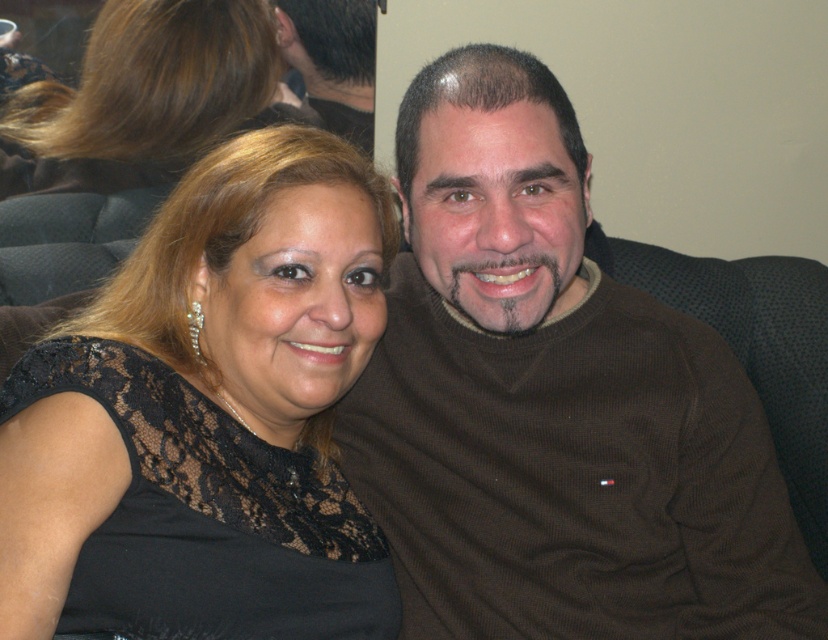
You are a photographer setting up for a portrait. You need to ensure that the black lace dress at upper left and the dark brown hair at upper center are both in focus. Based on their positions, which object should you prioritize focusing on to ensure it is sharp?

The dark brown hair at upper center should be prioritized for focus because it is closer to the camera than the black lace dress at upper left, making it easier to keep in sharp focus.

You are a photographer setting up for a group photo. You notice the brown lace dress at upper left and the dark brown hair at upper center in your frame. Which object takes up more horizontal space in the image?

The brown lace dress at upper left takes up more horizontal space than the dark brown hair at upper center because its width surpasses the latter according to the description.